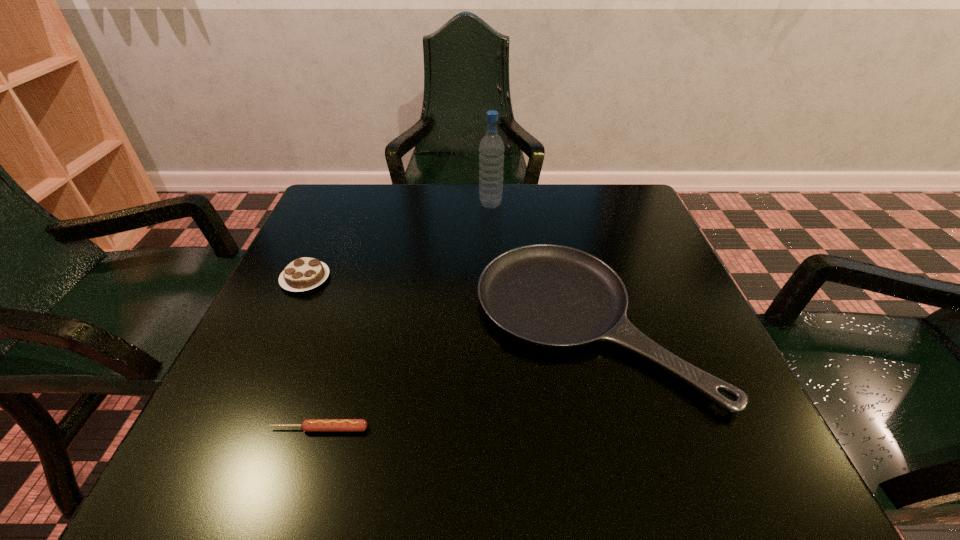
This screenshot has width=960, height=540. What are the coordinates of `vacant area between the water bottle and the sausage` in the screenshot? It's located at [x=405, y=316].

The image size is (960, 540). I want to click on empty space that is in between the sausage and the tallest object, so click(x=405, y=316).

I want to click on the closest object relative to the tallest object, so click(549, 295).

Select which object appears as the third closest to the shortest object. Please provide its 2D coordinates. Your answer should be formatted as a tuple, i.e. [(x, y)], where the tuple contains the x and y coordinates of a point satisfying the conditions above.

[(491, 148)]

Where is `blank area in the image that satisfies the following two spatial constraints: 1. on the front side of the shortest object; 2. on the right side of the chocolate cake`? The image size is (960, 540). blank area in the image that satisfies the following two spatial constraints: 1. on the front side of the shortest object; 2. on the right side of the chocolate cake is located at coordinates (237, 429).

I want to click on vacant space that satisfies the following two spatial constraints: 1. on the back side of the farthest object; 2. on the right side of the shortest object, so click(387, 205).